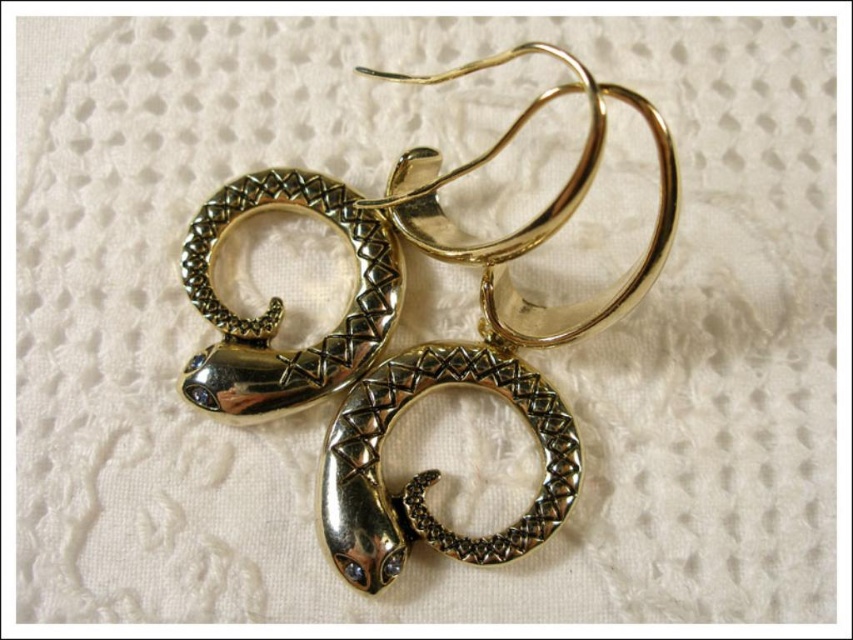
Is gold textured snake at center positioned before gold/metallic snake at center?

Yes, gold textured snake at center is in front of gold/metallic snake at center.

Can you confirm if gold textured snake at center is bigger than gold/metallic snake at center?

Correct, gold textured snake at center is larger in size than gold/metallic snake at center.

Measure the distance between gold textured snake at center and camera.

1.29 meters

At what (x,y) coordinates should I click in order to perform the action: click on gold textured snake at center. Please return your answer as a coordinate pair (x, y). The image size is (853, 640). Looking at the image, I should click on (433, 468).